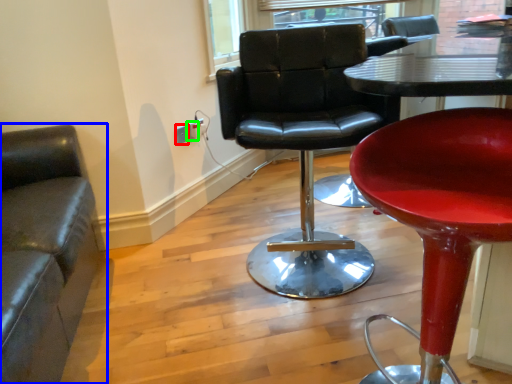
Question: Which object is the farthest from electric outlet (highlighted by a red box)? Choose among these: chair (highlighted by a blue box) or electric outlet (highlighted by a green box).

Choices:
 (A) chair
 (B) electric outlet

Answer: (A)